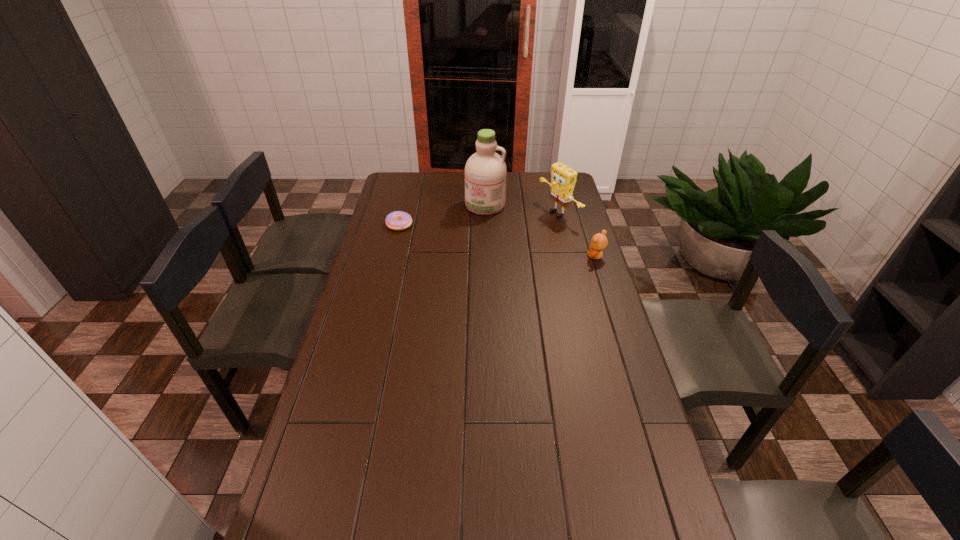
Identify the location of vacant spot on the desktop that is between the shortest object and the third tallest object and is positioned on the face of the third shortest object. The image size is (960, 540). (489, 239).

Locate an element on the screen. free space on the desktop that is between the leftmost object and the nearest object and is positioned on the front label of the tallest object is located at coordinates pos(468,235).